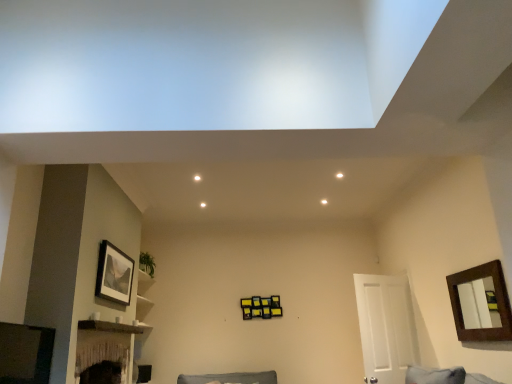
Question: Is brown wooden shelf at lower left located outside white matte door at right?

Choices:
 (A) no
 (B) yes

Answer: (B)

Question: Considering the relative positions of brown wooden shelf at lower left and white matte door at right in the image provided, is brown wooden shelf at lower left behind white matte door at right?

Choices:
 (A) yes
 (B) no

Answer: (B)

Question: Can you confirm if brown wooden shelf at lower left is wider than white matte door at right?

Choices:
 (A) yes
 (B) no

Answer: (B)

Question: From a real-world perspective, is brown wooden shelf at lower left over white matte door at right?

Choices:
 (A) no
 (B) yes

Answer: (B)

Question: Is brown wooden shelf at lower left to the right of white matte door at right from the viewer's perspective?

Choices:
 (A) yes
 (B) no

Answer: (B)

Question: From a real-world perspective, is brown wooden shelf at lower left physically located above or below brown wooden picture frame at upper right, which is the first picture frame in right-to-left order?

Choices:
 (A) below
 (B) above

Answer: (A)

Question: Visually, is brown wooden shelf at lower left positioned to the left or to the right of brown wooden picture frame at upper right, which is the first picture frame in right-to-left order?

Choices:
 (A) right
 (B) left

Answer: (B)

Question: Is brown wooden shelf at lower left bigger or smaller than brown wooden picture frame at upper right, which is the first picture frame in right-to-left order?

Choices:
 (A) small
 (B) big

Answer: (A)

Question: Is brown wooden shelf at lower left wider or thinner than brown wooden picture frame at upper right, the 2th picture frame from the left?

Choices:
 (A) thin
 (B) wide

Answer: (B)

Question: From their relative heights in the image, would you say brown wooden picture frame at upper right, the 2th picture frame from the left, is taller or shorter than matte black picture frame at upper left, the 2th picture frame when ordered from right to left?

Choices:
 (A) tall
 (B) short

Answer: (A)

Question: From the image's perspective, relative to matte black picture frame at upper left, the 1th picture frame positioned from the left, is brown wooden picture frame at upper right, the 2th picture frame from the left, above or below?

Choices:
 (A) above
 (B) below

Answer: (B)

Question: Is brown wooden picture frame at upper right, the 2th picture frame from the left, wider or thinner than matte black picture frame at upper left, the 1th picture frame positioned from the left?

Choices:
 (A) wide
 (B) thin

Answer: (B)

Question: Is brown wooden picture frame at upper right, which is the first picture frame in right-to-left order, in front of or behind matte black picture frame at upper left, the 1th picture frame positioned from the left, in the image?

Choices:
 (A) front
 (B) behind

Answer: (A)

Question: In terms of size, does brown wooden picture frame at upper right, which is the first picture frame in right-to-left order, appear bigger or smaller than white matte door at right?

Choices:
 (A) big
 (B) small

Answer: (B)

Question: From the image's perspective, is brown wooden picture frame at upper right, the 2th picture frame from the left, located above or below white matte door at right?

Choices:
 (A) above
 (B) below

Answer: (A)